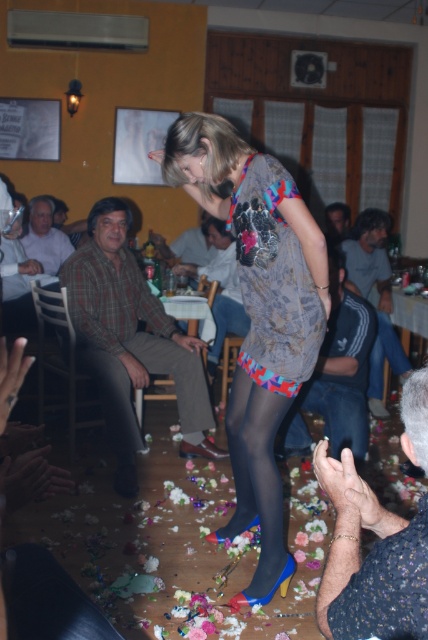
You are a photographer at a party and want to take a portrait of the woman. You notice the jeans at center and the black sheer tights at center in the frame. Which item appears taller in the photo?

The jeans at center appears taller than the black sheer tights at center in the photo.

You are a photographer at the event and need to capture a photo where both the smooth skin hands at lower right and the white shirt at left are visible. Based on their positions, which object should appear higher in the photo?

The white shirt at left should appear higher in the photo because the smooth skin hands at lower right is shorter than the white shirt at left.